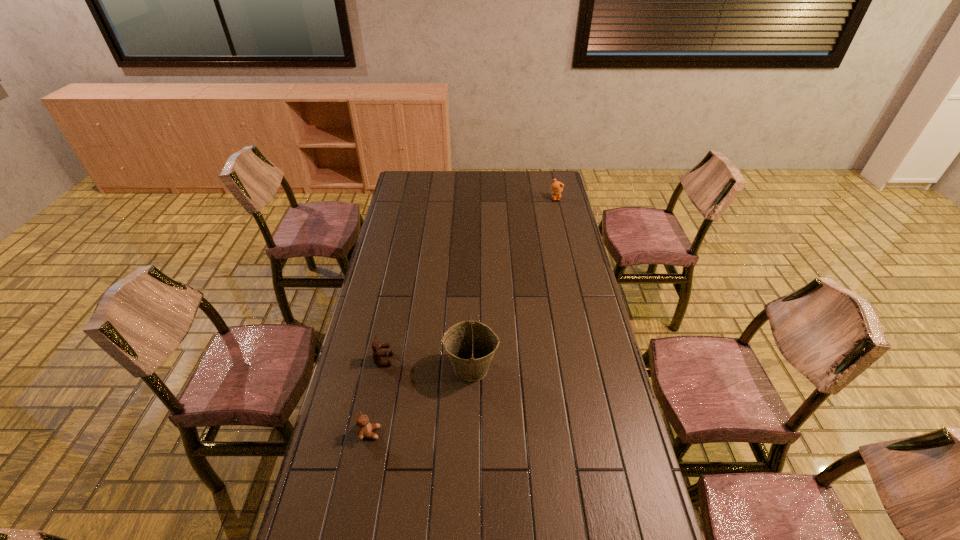
I want to click on vacant space that satisfies the following two spatial constraints: 1. on the face of the wine bucket; 2. on the left side of the second nearest teddy bear, so click(382, 368).

Locate an element on the screen. This screenshot has width=960, height=540. free space in the image that satisfies the following two spatial constraints: 1. on the face of the second nearest teddy bear; 2. on the right side of the wine bucket is located at coordinates 382,368.

Locate an element on the screen. The height and width of the screenshot is (540, 960). free spot that satisfies the following two spatial constraints: 1. on the face of the rightmost object; 2. on the face of the second farthest teddy bear is located at coordinates (593, 360).

The height and width of the screenshot is (540, 960). I want to click on free spot that satisfies the following two spatial constraints: 1. on the face of the farthest teddy bear; 2. on the face of the second farthest teddy bear, so pyautogui.click(x=593, y=360).

The image size is (960, 540). I want to click on free location that satisfies the following two spatial constraints: 1. on the face of the farthest teddy bear; 2. on the front-facing side of the nearest object, so click(611, 433).

Where is `vacant space that satisfies the following two spatial constraints: 1. on the face of the rightmost teddy bear; 2. on the face of the second nearest teddy bear`? This screenshot has height=540, width=960. vacant space that satisfies the following two spatial constraints: 1. on the face of the rightmost teddy bear; 2. on the face of the second nearest teddy bear is located at coordinates (593, 360).

The height and width of the screenshot is (540, 960). What are the coordinates of `free location that satisfies the following two spatial constraints: 1. on the face of the second farthest teddy bear; 2. on the right side of the third object from left to right` in the screenshot? It's located at (382, 368).

At what (x,y) coordinates should I click in order to perform the action: click on vacant space that satisfies the following two spatial constraints: 1. on the face of the farthest teddy bear; 2. on the face of the second nearest teddy bear. Please return your answer as a coordinate pair (x, y). Image resolution: width=960 pixels, height=540 pixels. Looking at the image, I should click on (593, 360).

This screenshot has width=960, height=540. I want to click on blank area in the image that satisfies the following two spatial constraints: 1. on the face of the rightmost object; 2. on the face of the second farthest teddy bear, so click(593, 360).